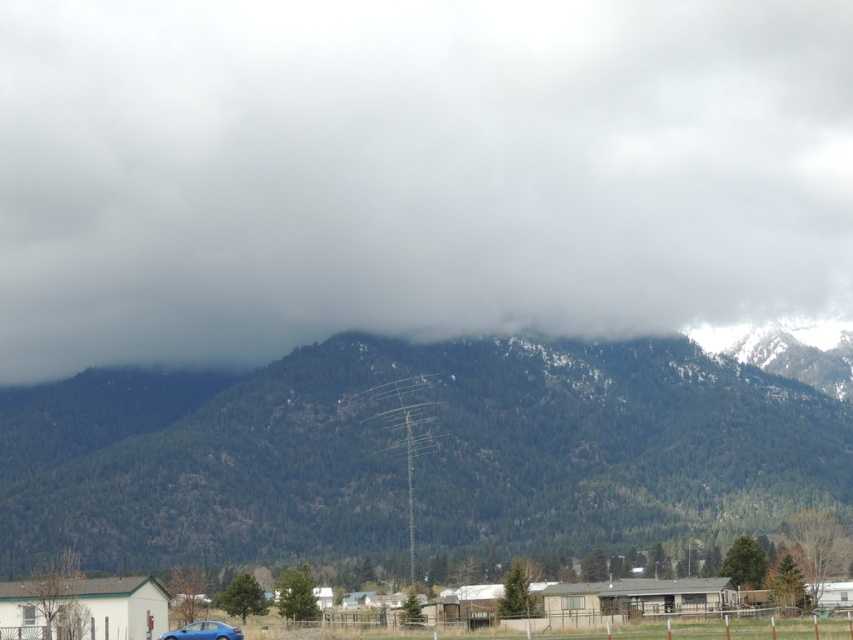
Question: Can you confirm if white fluffy cloud at upper center is positioned to the left of green forested mountain at center?

Choices:
 (A) no
 (B) yes

Answer: (B)

Question: Is white fluffy cloud at upper center smaller than green forested mountain at center?

Choices:
 (A) no
 (B) yes

Answer: (A)

Question: Which of the following is the closest to the observer?

Choices:
 (A) (717, 387)
 (B) (219, 180)

Answer: (A)

Question: Which object is farther from the camera taking this photo?

Choices:
 (A) green forested mountain at center
 (B) white fluffy cloud at upper center

Answer: (B)

Question: Is white fluffy cloud at upper center positioned at the back of green forested mountain at center?

Choices:
 (A) no
 (B) yes

Answer: (B)